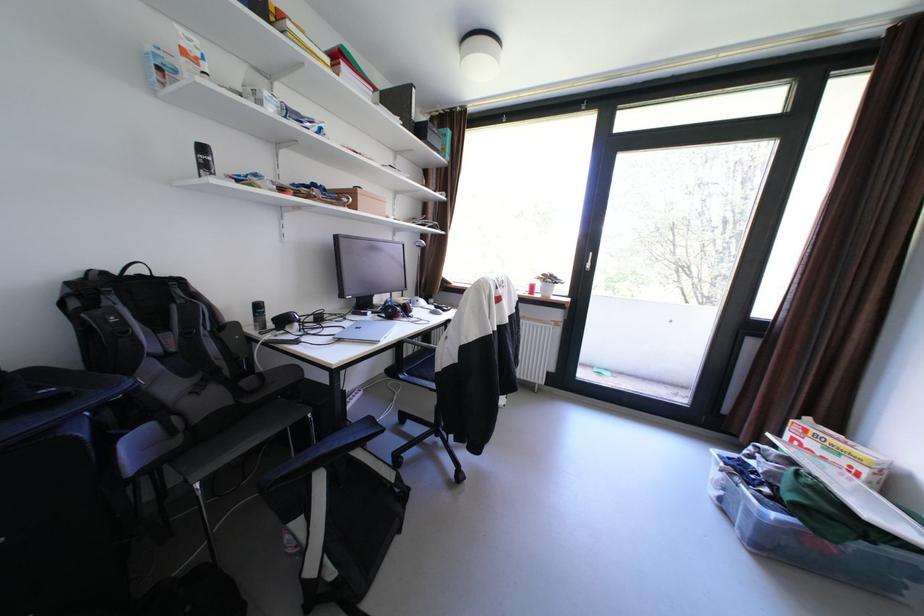
Where would you lift the small cardboard box? Please return your answer as a coordinate pair (x, y).

(361, 200)